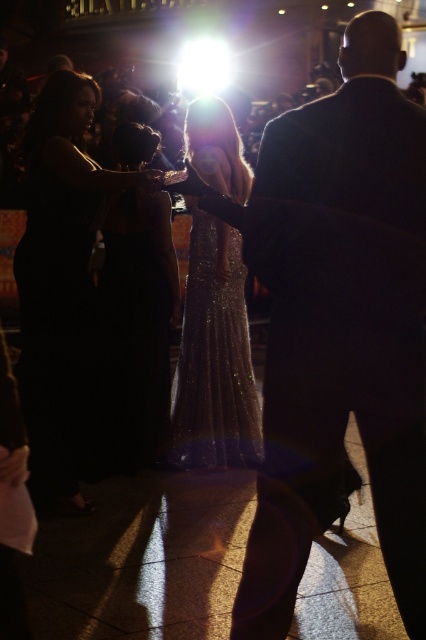
Question: Which object is positioned farthest from the shiny black suit at center?

Choices:
 (A) black sequined dress at left
 (B) sparkly gold dress at center
 (C) black satin dress at center

Answer: (C)

Question: Which of the following is the farthest from the observer?

Choices:
 (A) black sequined dress at left
 (B) shiny black suit at center

Answer: (A)

Question: Can you confirm if shiny black suit at center is positioned to the left of sparkly gold dress at center?

Choices:
 (A) no
 (B) yes

Answer: (A)

Question: Does black sequined dress at left come behind sparkly gold dress at center?

Choices:
 (A) no
 (B) yes

Answer: (A)

Question: Among these objects, which one is nearest to the camera?

Choices:
 (A) shiny black suit at center
 (B) black sequined dress at left
 (C) black satin dress at center

Answer: (A)

Question: Does black sequined dress at left appear on the left side of black satin dress at center?

Choices:
 (A) no
 (B) yes

Answer: (B)